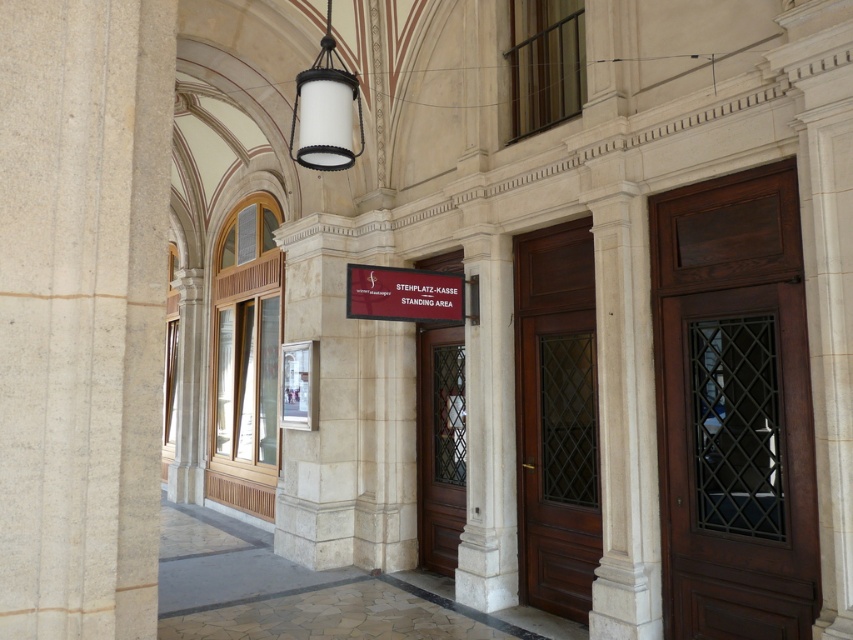
Question: Can you confirm if white matte lantern at upper center is positioned above red matte sign at center?

Choices:
 (A) yes
 (B) no

Answer: (A)

Question: Is white stone column at center in front of brown wooden door at center?

Choices:
 (A) yes
 (B) no

Answer: (A)

Question: Which point is closer to the camera?

Choices:
 (A) (450, 374)
 (B) (402, 291)

Answer: (B)

Question: Based on their relative distances, which object is nearer to the white stone column at center?

Choices:
 (A) white matte lantern at upper center
 (B) brown wooden door at center
 (C) red matte sign at center
 (D) mahogany wood door at center

Answer: (D)

Question: In this image, where is mahogany wood door at right located relative to red matte sign at center?

Choices:
 (A) below
 (B) above

Answer: (A)

Question: Which object appears closest to the camera in this image?

Choices:
 (A) mahogany wood door at right
 (B) white stone column at center
 (C) red matte sign at center

Answer: (A)